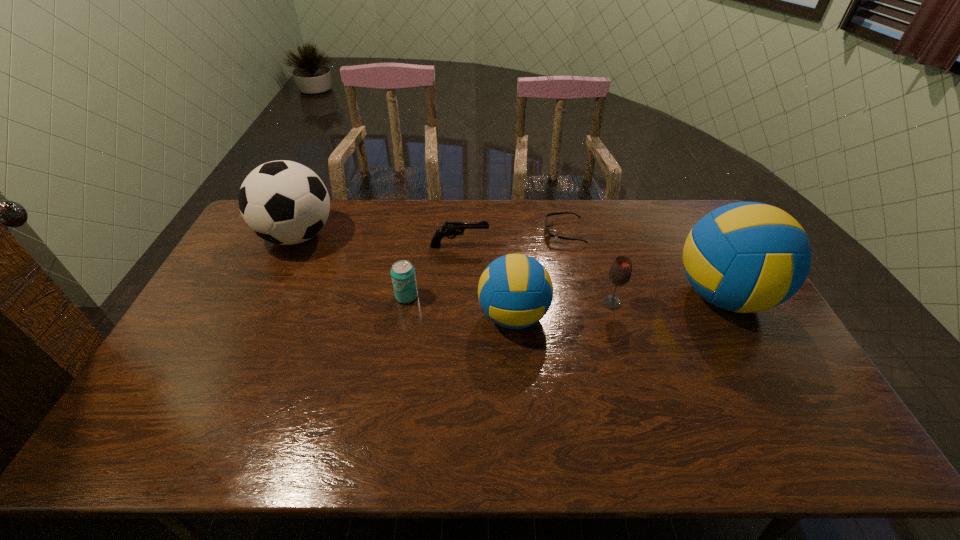
The image size is (960, 540). I want to click on object at the left edge, so click(283, 202).

The height and width of the screenshot is (540, 960). Identify the location of object that is at the right edge. (745, 257).

The width and height of the screenshot is (960, 540). I want to click on object that is at the far left corner, so click(x=283, y=202).

At what (x,y) coordinates should I click in order to perform the action: click on vacant space at the far edge of the desktop. Please return your answer as a coordinate pair (x, y). This screenshot has height=540, width=960. Looking at the image, I should click on (542, 227).

Where is `free spot at the near edge of the desktop`? free spot at the near edge of the desktop is located at coordinates (468, 386).

The height and width of the screenshot is (540, 960). I want to click on free space at the left edge of the desktop, so click(251, 305).

Identify the location of free space at the right edge. (768, 330).

Image resolution: width=960 pixels, height=540 pixels. Find the location of `vacant space at the far right corner`. vacant space at the far right corner is located at coordinates (672, 209).

Where is `free space between the left volleyball and the beer can`? The image size is (960, 540). free space between the left volleyball and the beer can is located at coordinates (460, 306).

Where is `free area in between the gun and the soccer ball`? This screenshot has width=960, height=540. free area in between the gun and the soccer ball is located at coordinates (378, 241).